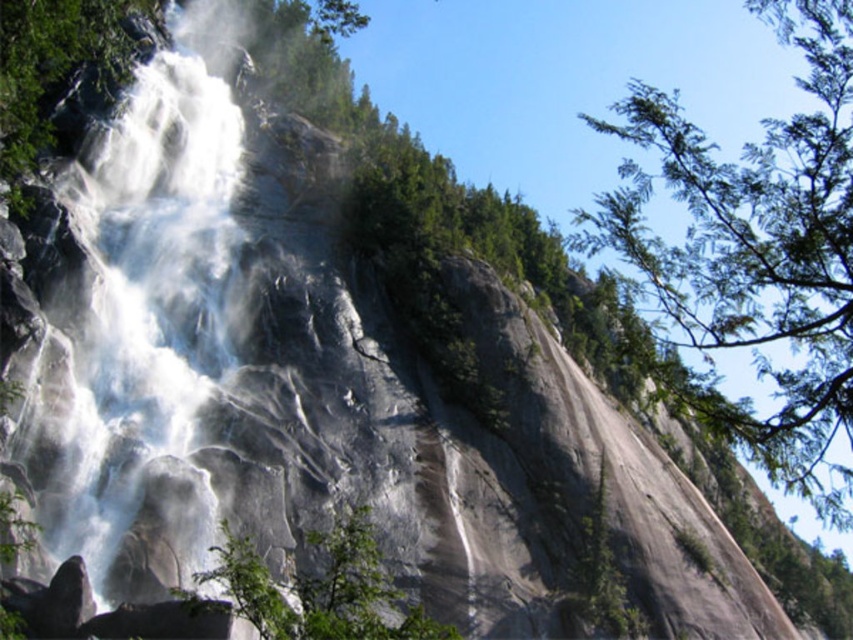
Looking at the waterfall scene, where is the white mist at center in relation to the green leafy tree at center?

The white mist at center is to the left of the green leafy tree at center.